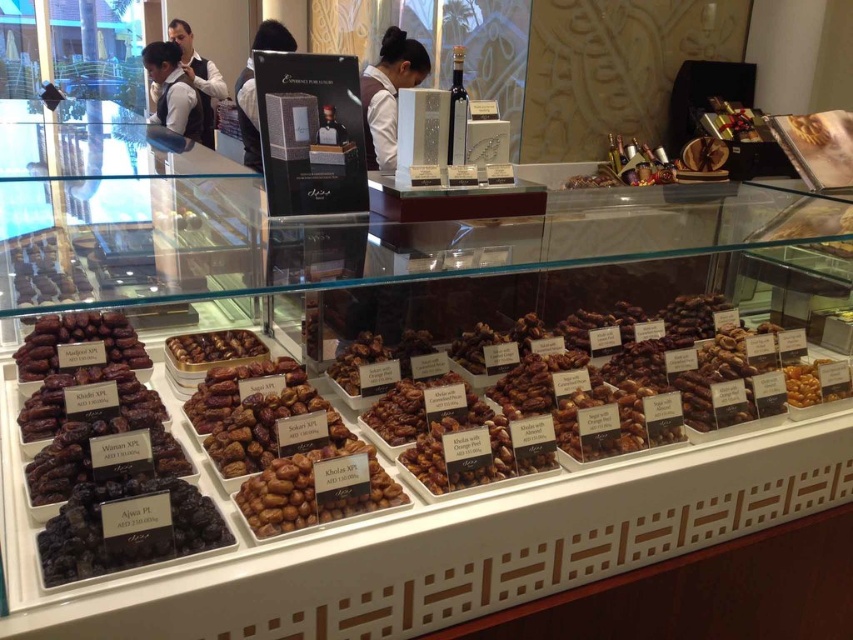
Is point (19, 352) positioned in front of point (253, 164)?

Yes.

Who is shorter, dark brown dried fruit at lower left or matte black uniform at upper center?

With less height is dark brown dried fruit at lower left.

Is point (125, 476) farther from viewer compared to point (253, 84)?

No.

At what (x,y) coordinates should I click in order to perform the action: click on dark brown dried fruit at lower left. Please return your answer as a coordinate pair (x, y). Looking at the image, I should click on (108, 461).

Is brown matte dates at center below brown matte nuts at center?

A: Indeed, brown matte dates at center is positioned under brown matte nuts at center.

Where is `brown matte dates at center`? The image size is (853, 640). brown matte dates at center is located at coordinates (312, 492).

Who is taller, white uniform at center or white shirt at upper left?

Standing taller between the two is white shirt at upper left.

Can you confirm if white uniform at center is positioned to the right of white shirt at upper left?

Yes, white uniform at center is to the right of white shirt at upper left.

Is point (405, 64) farther from viewer compared to point (201, 118)?

No, it is in front of (201, 118).

This screenshot has width=853, height=640. I want to click on white uniform at center, so click(x=389, y=93).